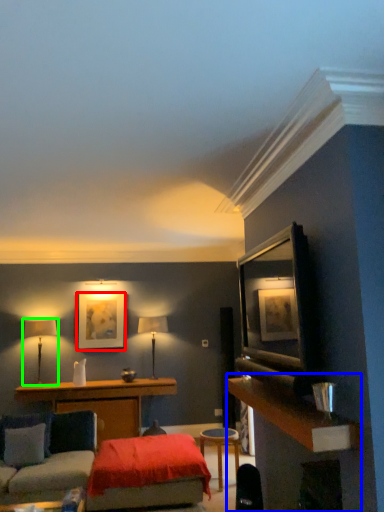
Question: Which object is the farthest from picture frame (highlighted by a red box)? Choose among these: dresser (highlighted by a blue box) or table lamp (highlighted by a green box).

Choices:
 (A) dresser
 (B) table lamp

Answer: (A)